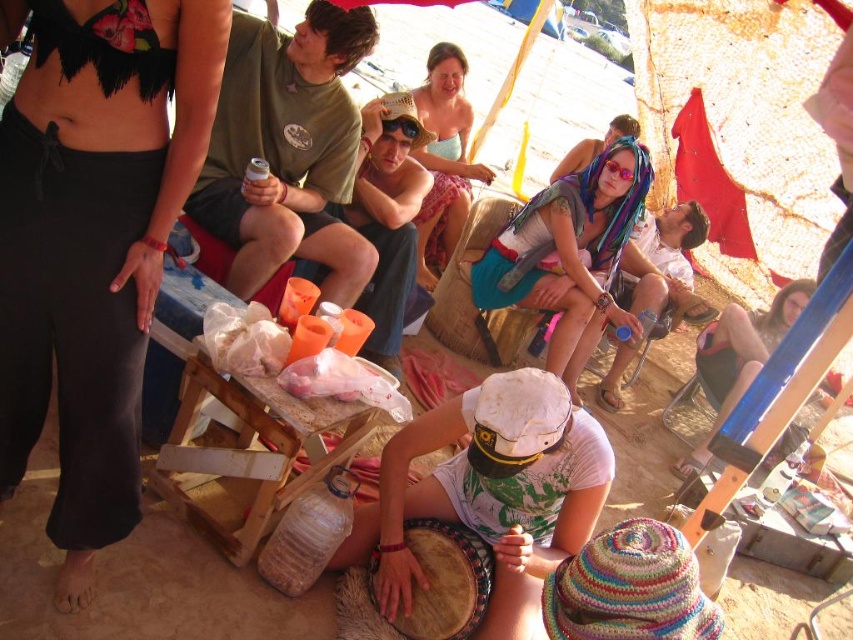
In the scene shown: You are a photographer at the beach and want to capture both the black fabric bikini top at upper left and the light blue fabric dress at center in the same frame. Which object should you focus on first to ensure both are in the shot?

The black fabric bikini top at upper left is located below the light blue fabric dress at center, so you should focus on the light blue fabric dress at center first to ensure both are in the shot.

You are a photographer at the beach and want to capture a closeup of the black fabric bikini top at upper left. The camera you are using has a focus point at coordinate point (93, 243). Will this focus point be effective for capturing the black fabric bikini top at upper left?

Yes, the focus point at point (93, 243) will be effective because the point is on the black fabric bikini top at upper left, ensuring accurate focus on the desired subject.

You are standing at the beach and see two points marked in the scene. Which point, point (x=523, y=390) or point (x=596, y=205), is closer to you?

Point (x=523, y=390) is closer to the viewer than point (x=596, y=205).